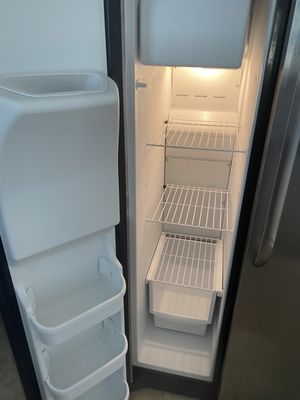
Image resolution: width=300 pixels, height=400 pixels. Identify the location of fridge light. (205, 71).